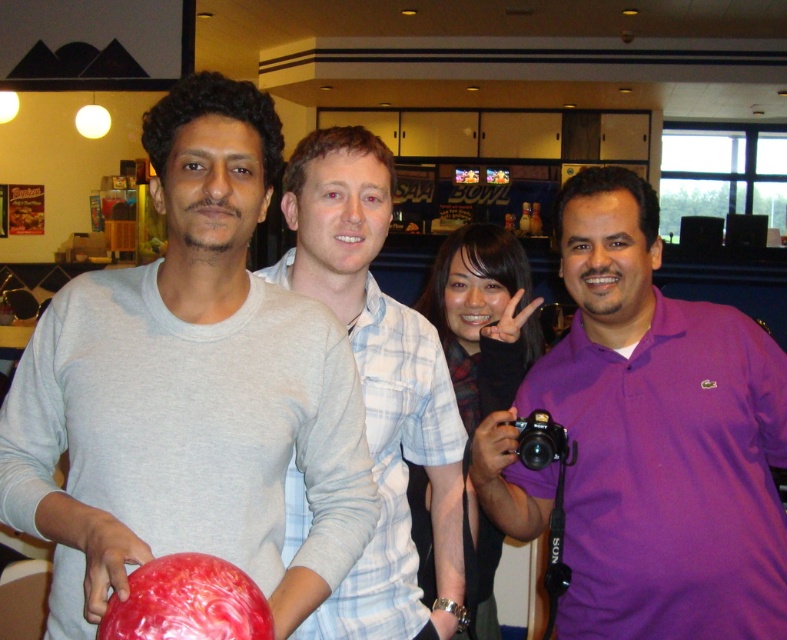
Question: Which object appears closest to the camera in this image?

Choices:
 (A) matte gray sweater at left
 (B) purple cotton shirt at right

Answer: (A)

Question: Among these objects, which one is nearest to the camera?

Choices:
 (A) matte gray sweater at left
 (B) purple cotton shirt at right
 (C) shiny red bowling ball at lower left
 (D) light blue plaid shirt at center

Answer: (C)

Question: Which point appears closest to the camera in this image?

Choices:
 (A) (758, 499)
 (B) (156, 445)

Answer: (B)

Question: Is matte gray sweater at left in front of purple cotton shirt at right?

Choices:
 (A) no
 (B) yes

Answer: (B)

Question: Where is matte gray sweater at left located in relation to shiny red bowling ball at lower left in the image?

Choices:
 (A) right
 (B) left

Answer: (B)

Question: Does purple cotton shirt at right have a larger size compared to shiny red bowling ball at lower left?

Choices:
 (A) no
 (B) yes

Answer: (B)